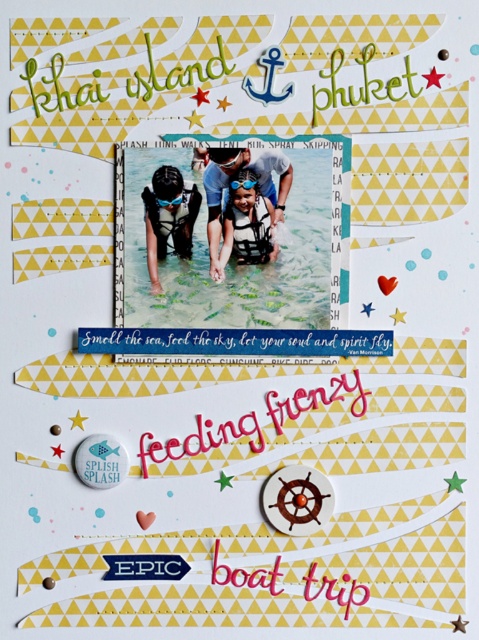
You are designing a scrapbook layout and want to add a sticker of a fish. The sticker is 2 inches wide. The clear water at center and white life vest at center are both in the central area. Which object can you place the fish sticker next to without overlapping, considering their sizes?

The clear water at center is larger in size than the white life vest at center, so the fish sticker can be placed next to the clear water at center since it has more space available.

You are designing a scrapbook layout and want to place a sticker of a fish between the clear water at center and the matte green snorkel at center. Based on their widths, which object should the fish sticker be closer to?

The clear water at center has a larger width than the matte green snorkel at center, so the fish sticker should be placed closer to the clear water at center.

You are designing a scrapbook layout and need to place a sticker between the two points, point (306,248) and point (159,172). Which point should the sticker be closer to if you want it to appear closer to the viewer?

The sticker should be placed closer to point (306,248) because it is further to the viewer than point (159,172).